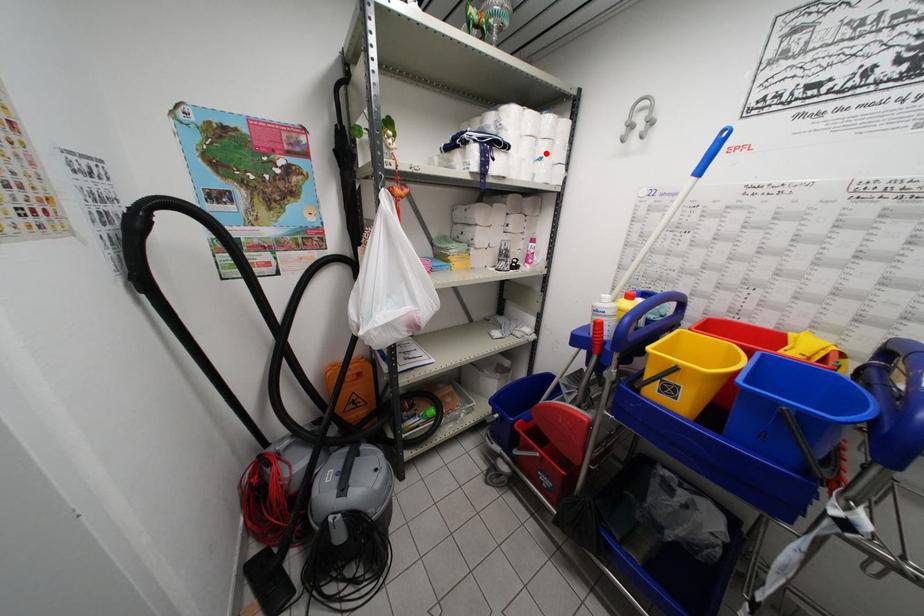
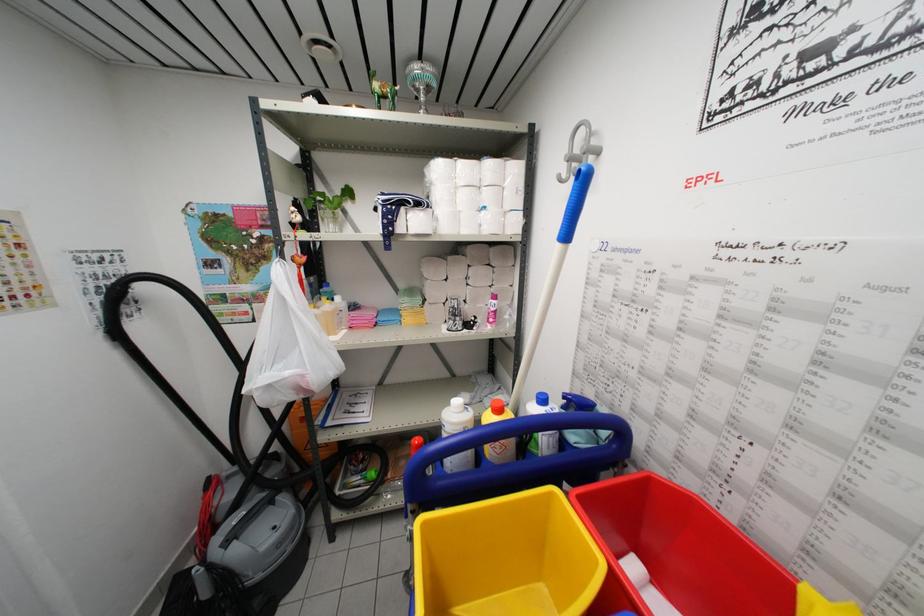
In the second image, find the point that corresponds to the highlighted location in the first image.

(490, 201)